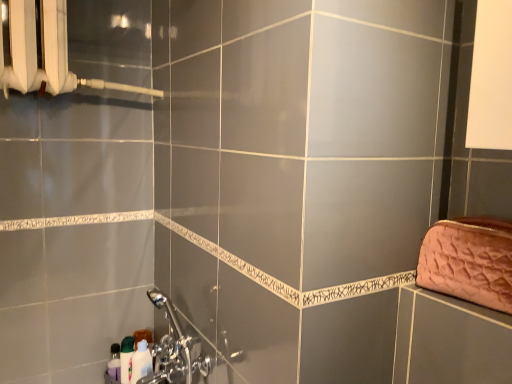
Question: Considering the relative sizes of chrome metallic faucet at lower left and green glossy bottle at lower left, the second toiletry in the left-to-right sequence, in the image provided, is chrome metallic faucet at lower left shorter than green glossy bottle at lower left, the second toiletry in the left-to-right sequence,?

Choices:
 (A) no
 (B) yes

Answer: (A)

Question: Is chrome metallic faucet at lower left touching green glossy bottle at lower left, the second toiletry in the left-to-right sequence?

Choices:
 (A) yes
 (B) no

Answer: (B)

Question: Considering the relative positions of chrome metallic faucet at lower left and green glossy bottle at lower left, acting as the second toiletry starting from the right, in the image provided, is chrome metallic faucet at lower left to the left of green glossy bottle at lower left, acting as the second toiletry starting from the right, from the viewer's perspective?

Choices:
 (A) no
 (B) yes

Answer: (A)

Question: Is chrome metallic faucet at lower left wider than green glossy bottle at lower left, the second toiletry in the left-to-right sequence?

Choices:
 (A) yes
 (B) no

Answer: (A)

Question: From a real-world perspective, is chrome metallic faucet at lower left located higher than green glossy bottle at lower left, acting as the second toiletry starting from the right?

Choices:
 (A) no
 (B) yes

Answer: (B)

Question: From a real-world perspective, is pink quilted fabric clutch at right positioned above or below green glossy bottle at lower left, the second toiletry in the left-to-right sequence?

Choices:
 (A) below
 (B) above

Answer: (B)

Question: Considering the positions of pink quilted fabric clutch at right and green glossy bottle at lower left, acting as the second toiletry starting from the right, in the image, is pink quilted fabric clutch at right wider or thinner than green glossy bottle at lower left, acting as the second toiletry starting from the right,?

Choices:
 (A) wide
 (B) thin

Answer: (A)

Question: Based on their positions, is pink quilted fabric clutch at right located to the left or right of green glossy bottle at lower left, acting as the second toiletry starting from the right?

Choices:
 (A) right
 (B) left

Answer: (A)

Question: Considering the positions of point (462, 228) and point (121, 359), is point (462, 228) closer or farther from the camera than point (121, 359)?

Choices:
 (A) closer
 (B) farther

Answer: (A)

Question: Is point (22, 36) closer or farther from the camera than point (133, 372)?

Choices:
 (A) farther
 (B) closer

Answer: (B)

Question: From a real-world perspective, is white plastic radiator at upper left above or below white glossy bottle at lower left, the third toiletry viewed from the left?

Choices:
 (A) below
 (B) above

Answer: (B)

Question: Looking at their shapes, would you say white plastic radiator at upper left is wider or thinner than white glossy bottle at lower left, placed as the first toiletry when sorted from right to left?

Choices:
 (A) wide
 (B) thin

Answer: (A)

Question: Is white plastic radiator at upper left in front of or behind white glossy bottle at lower left, the third toiletry viewed from the left, in the image?

Choices:
 (A) front
 (B) behind

Answer: (A)

Question: Is green glossy bottle at lower left, the second toiletry in the left-to-right sequence, wider or thinner than chrome metallic faucet at lower left?

Choices:
 (A) thin
 (B) wide

Answer: (A)

Question: From a real-world perspective, is green glossy bottle at lower left, acting as the second toiletry starting from the right, physically located above or below chrome metallic faucet at lower left?

Choices:
 (A) below
 (B) above

Answer: (A)